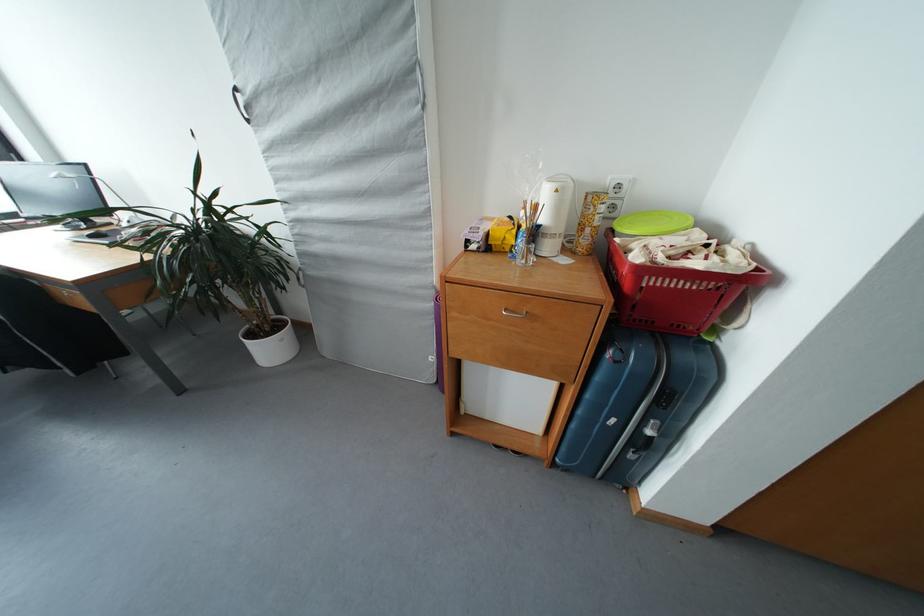
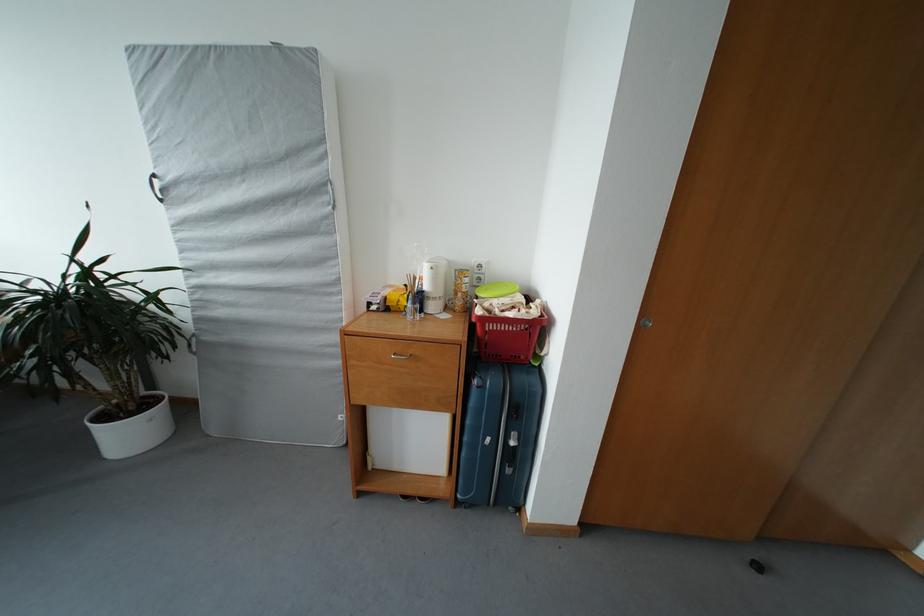
The point at (286,315) is marked in the first image. Where is the corresponding point in the second image?

(159, 391)